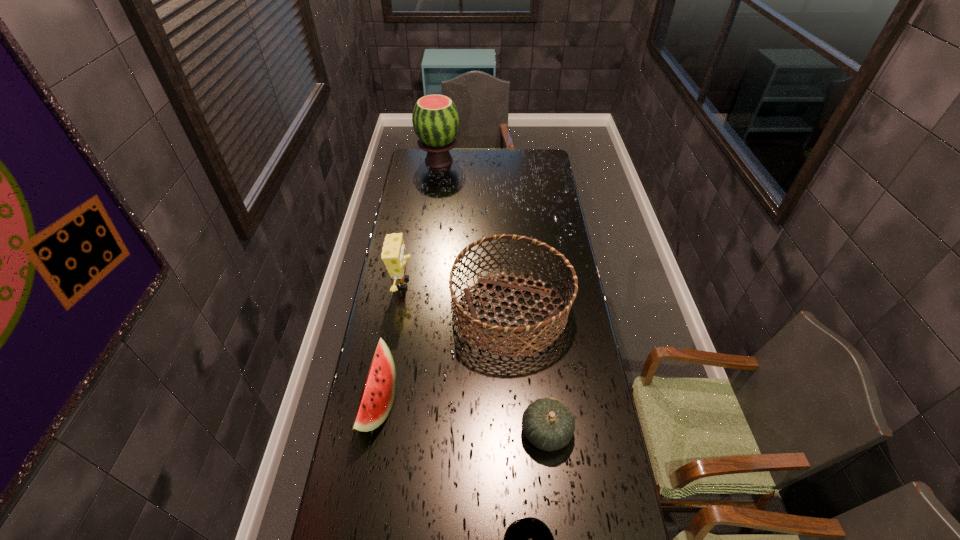
At what (x,y) coordinates should I click in order to perform the action: click on free space at the far left corner. Please return your answer as a coordinate pair (x, y). The width and height of the screenshot is (960, 540). Looking at the image, I should click on (414, 153).

Locate an element on the screen. Image resolution: width=960 pixels, height=540 pixels. free area in between the sponge and the gourd is located at coordinates (474, 357).

Identify the location of free space between the gourd and the sponge. The width and height of the screenshot is (960, 540). pos(474,357).

Locate an element on the screen. This screenshot has width=960, height=540. free space between the fourth tallest object and the farther watermelon is located at coordinates (408, 282).

Locate an element on the screen. The image size is (960, 540). free space between the farthest object and the nearer watermelon is located at coordinates (408, 282).

Identify which object is located as the nearest to the third shortest object. Please provide its 2D coordinates. Your answer should be formatted as a tuple, i.e. [(x, y)], where the tuple contains the x and y coordinates of a point satisfying the conditions above.

[(554, 315)]

Image resolution: width=960 pixels, height=540 pixels. What are the coordinates of `the closest object to the gourd` in the screenshot? It's located at (554, 315).

This screenshot has height=540, width=960. Identify the location of blank space that satisfies the following two spatial constraints: 1. on the face of the sponge; 2. on the back side of the basket. (397, 313).

This screenshot has width=960, height=540. Find the location of `vacant area that satisfies the following two spatial constraints: 1. on the face of the sponge; 2. on the right side of the gourd`. vacant area that satisfies the following two spatial constraints: 1. on the face of the sponge; 2. on the right side of the gourd is located at coordinates (378, 431).

At what (x,y) coordinates should I click in order to perform the action: click on blank area in the image that satisfies the following two spatial constraints: 1. on the back side of the gourd; 2. on the face of the sponge. Please return your answer as a coordinate pair (x, y). Image resolution: width=960 pixels, height=540 pixels. Looking at the image, I should click on (531, 283).